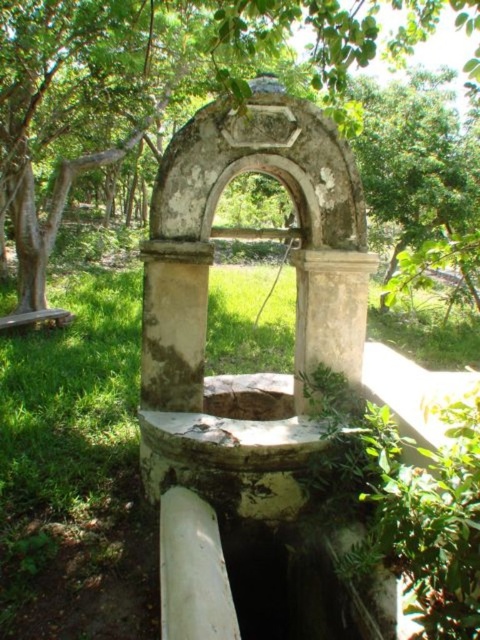
You are standing in front of the old stone archway and notice two green elements in the scene. Which one is wider, the green grass at center or the green leafy tree at center?

The green leafy tree at center is wider than the green grass at center.

You are standing in front of an old stone archway leading to a dark underground area. You notice green grass at center and a green leafy tree at center. Which object is closer to the ground?

The green grass at center is closer to the ground because it is positioned below the green leafy tree at center.

You are standing in front of the old stone archway. You see green grass at center and green leafy tree at center. Which of these is closer to you?

The green grass at center is closer to you because it is in front of the green leafy tree at center.